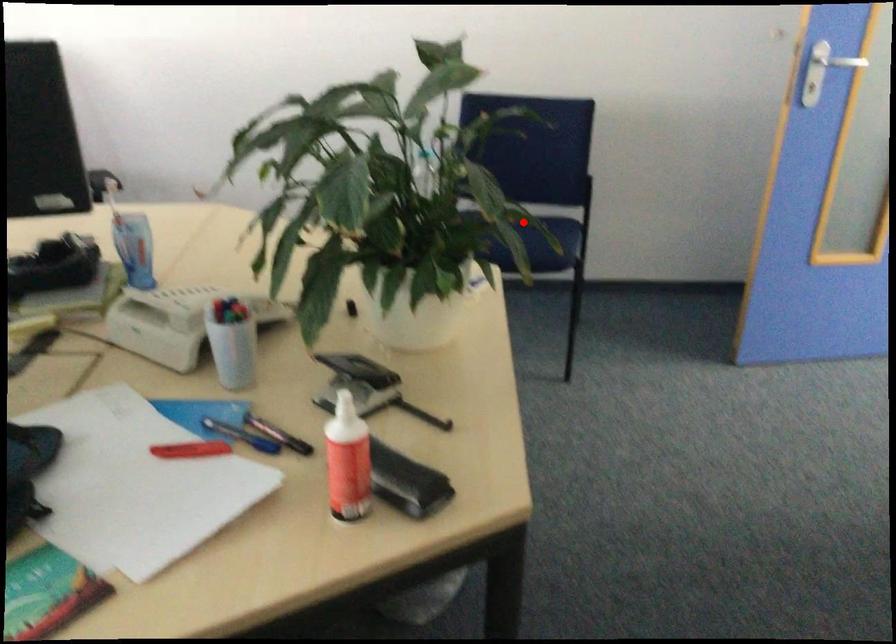
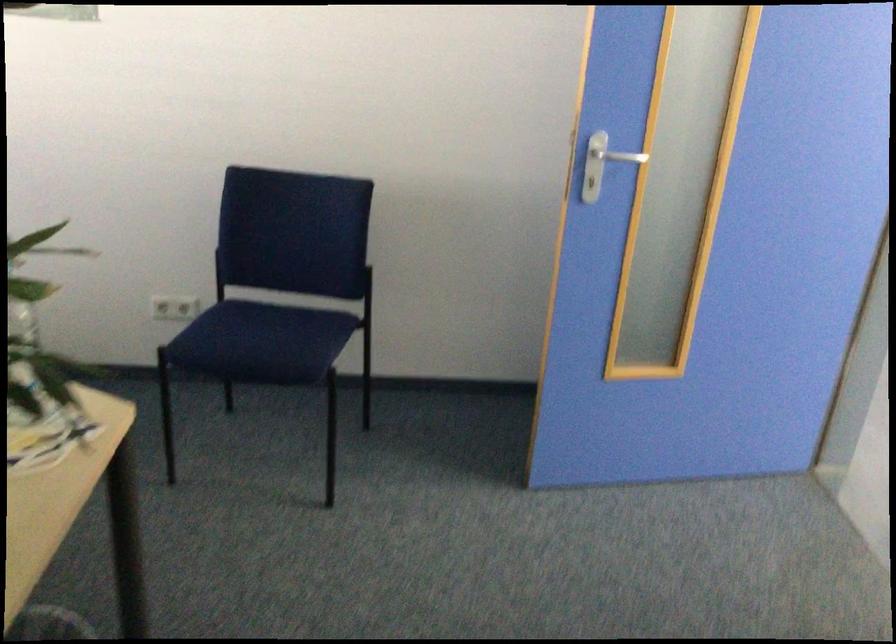
Question: A red point is marked in image1. In image2, is the corresponding 3D point closer to the camera or farther? Reply with the corresponding letter.

Choices:
 (A) The corresponding 3D point is closer.
 (B) The corresponding 3D point is farther.

Answer: (A)